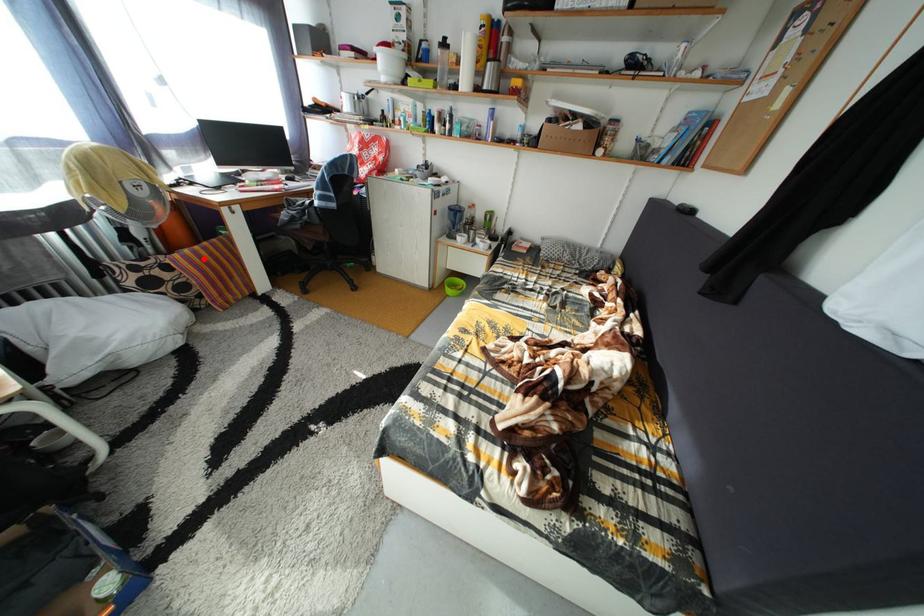
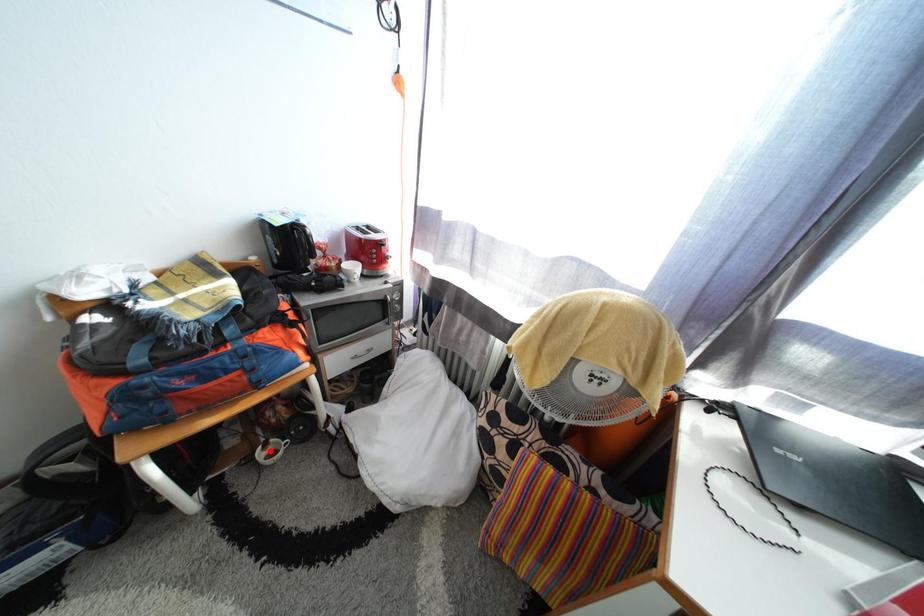
I am providing you with two images of the same scene from different viewpoints. A red point is marked on the first image and another point is marked on the second image. Is the red point in image1 aligned with the point shown in image2?

No